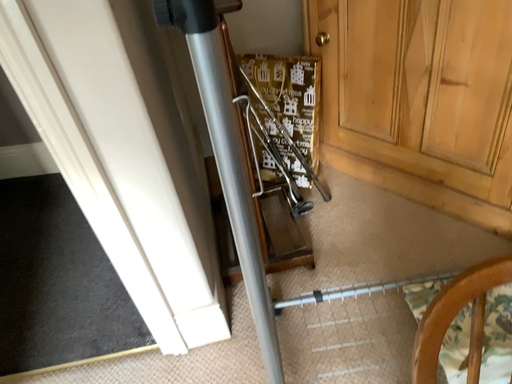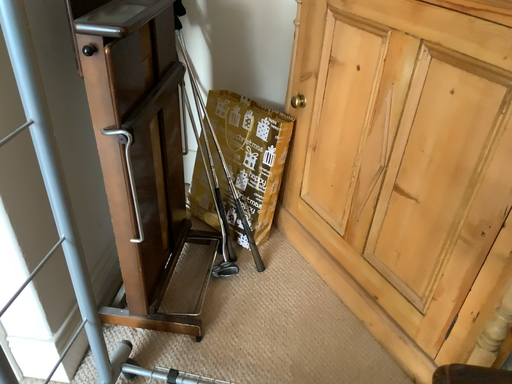
Question: Which way did the camera rotate in the video?

Choices:
 (A) rotated right
 (B) rotated left

Answer: (B)